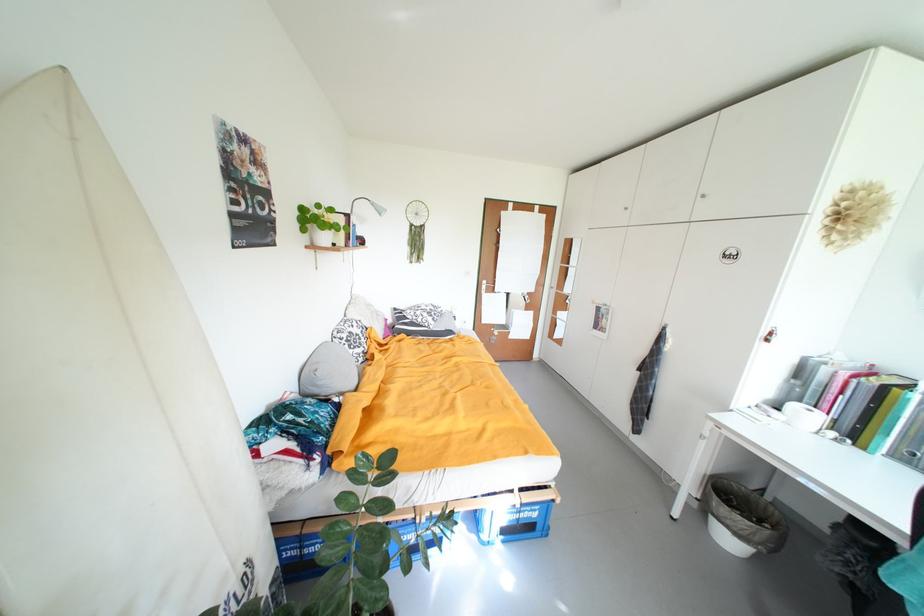
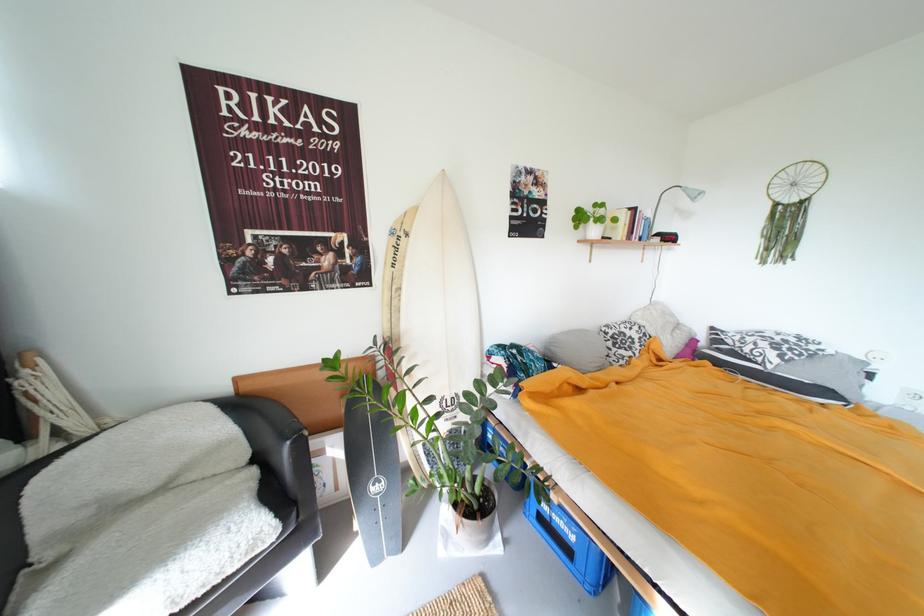
Find the pixel in the second image that matches point 387,213 in the first image.

(703, 198)